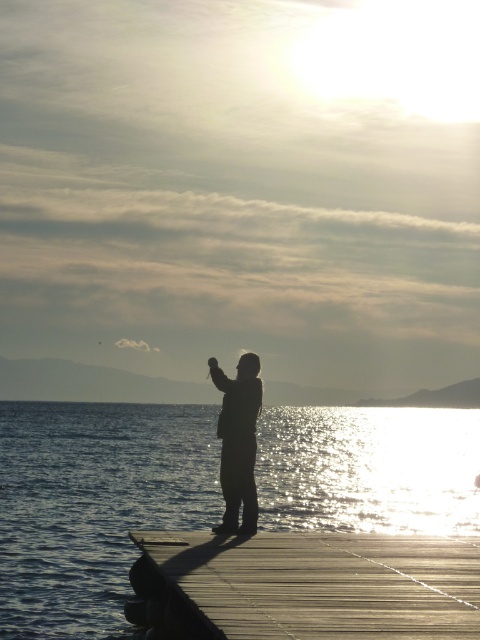
Question: Which point appears closest to the camera in this image?

Choices:
 (A) (479, 516)
 (B) (228, 520)

Answer: (B)

Question: Is shiny blue water at center above wooden at center?

Choices:
 (A) no
 (B) yes

Answer: (A)

Question: Does wooden at center lie in front of silhouette figure at center?

Choices:
 (A) yes
 (B) no

Answer: (A)

Question: Which is farther from the wooden at center?

Choices:
 (A) shiny blue water at center
 (B) silhouette figure at center

Answer: (A)

Question: Observing the image, what is the correct spatial positioning of shiny blue water at center in reference to silhouette figure at center?

Choices:
 (A) left
 (B) right

Answer: (A)

Question: Among these objects, which one is farthest from the camera?

Choices:
 (A) silhouette figure at center
 (B) wooden at center

Answer: (A)